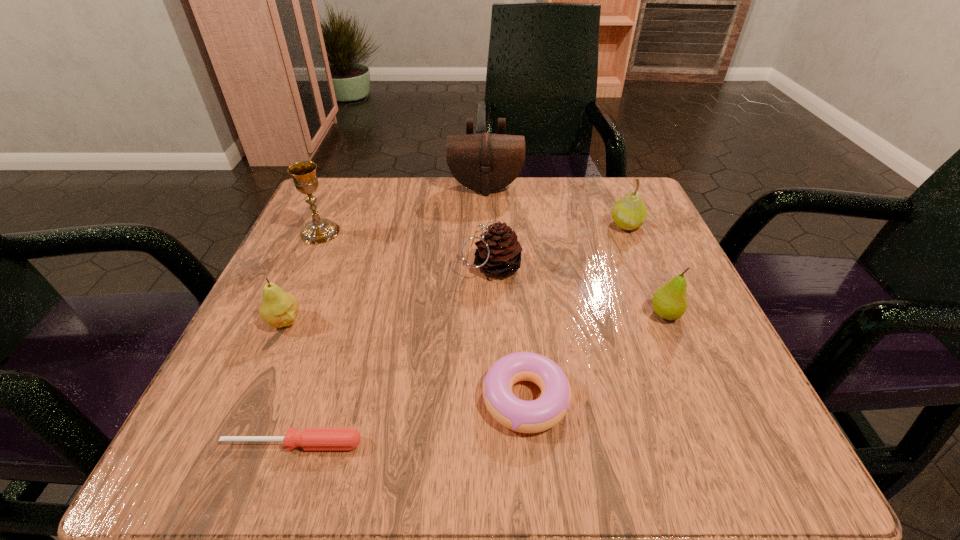
This screenshot has width=960, height=540. What are the coordinates of `free spot between the doughnut and the chalice` in the screenshot? It's located at (422, 315).

Where is `vacant space in between the chalice and the farthest pear`? The width and height of the screenshot is (960, 540). vacant space in between the chalice and the farthest pear is located at coordinates [473, 228].

Identify the location of vacant space that's between the leftmost pear and the screwdriver. Image resolution: width=960 pixels, height=540 pixels. (289, 382).

Locate which object is the fifth closest to the farthest pear. Please provide its 2D coordinates. Your answer should be formatted as a tuple, i.e. [(x, y)], where the tuple contains the x and y coordinates of a point satisfying the conditions above.

[(319, 230)]

Locate an element on the screen. object that is the second closest to the chalice is located at coordinates (485, 162).

This screenshot has height=540, width=960. In order to click on pear that can be found as the closest to the doughnut in this screenshot , I will do `click(669, 302)`.

Identify the location of pear that is the third closest to the chalice. (669, 302).

The width and height of the screenshot is (960, 540). Identify the location of vacant area that satisfies the following two spatial constraints: 1. with a leaf charm attached to the fifth nearest object; 2. on the left side of the seventh tallest object. (495, 399).

This screenshot has height=540, width=960. In order to click on vacant space that satisfies the following two spatial constraints: 1. with a leaf charm attached to the pinecone; 2. on the left side of the second shortest object in this screenshot , I will do `click(495, 399)`.

Identify the location of free spot that satisfies the following two spatial constraints: 1. with the flap open on the farthest pear; 2. on the right side of the farthest object. The width and height of the screenshot is (960, 540). (486, 225).